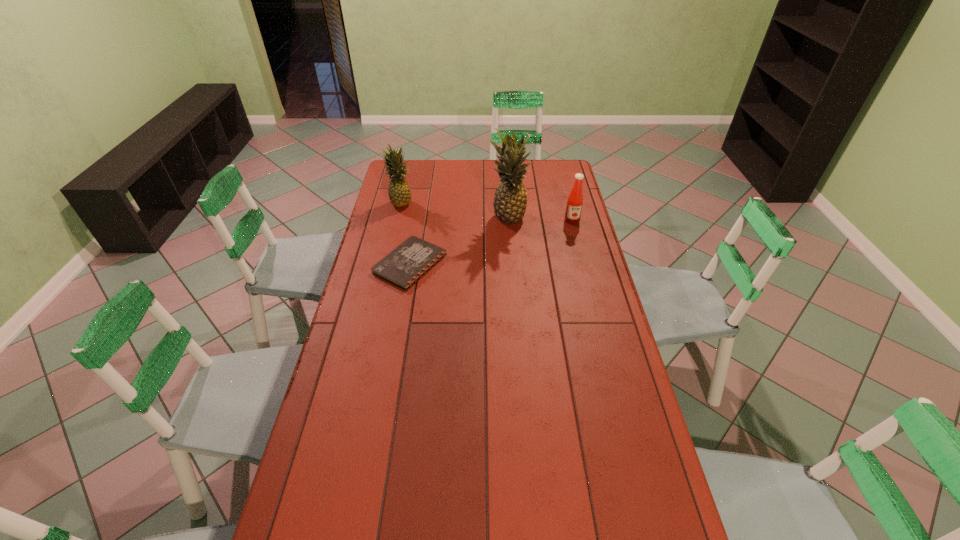
I want to click on vacant area situated on the front-facing side of the condiment, so click(577, 241).

The height and width of the screenshot is (540, 960). I want to click on free space located on the front of the notebook, so (x=402, y=311).

You are a GUI agent. You are given a task and a screenshot of the screen. Output one action in this format:
    pyautogui.click(x=<x>, y=<y>)
    Task: Click on the pineapple that is at the left edge
    The image size is (960, 540).
    Given the screenshot: What is the action you would take?
    pyautogui.click(x=399, y=192)

Locate an element on the screen. notebook positioned at the left edge is located at coordinates (411, 260).

The width and height of the screenshot is (960, 540). Find the location of `object present at the right edge`. object present at the right edge is located at coordinates (575, 200).

In the image, there is a desktop. Where is `vacant area at the far edge`? vacant area at the far edge is located at coordinates (530, 169).

In the image, there is a desktop. Identify the location of free space at the left edge. The height and width of the screenshot is (540, 960). (393, 226).

In order to click on vacant space at the right edge of the desktop in this screenshot , I will do `click(553, 217)`.

Identify the location of vacant space at the far left corner of the desktop. The width and height of the screenshot is (960, 540). (412, 178).

Identify the location of vacant space at the far right corner of the desktop. The width and height of the screenshot is (960, 540). (555, 159).